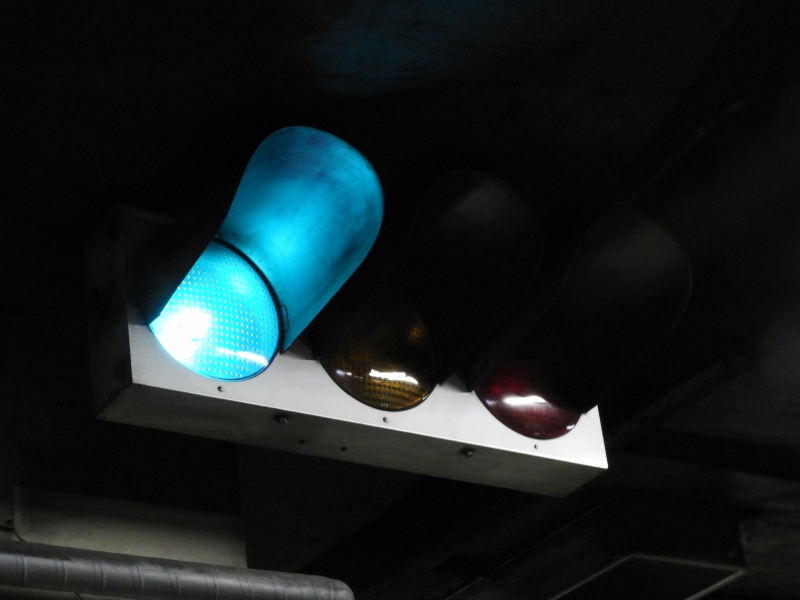
Identify the location of yellow light. (386, 379).